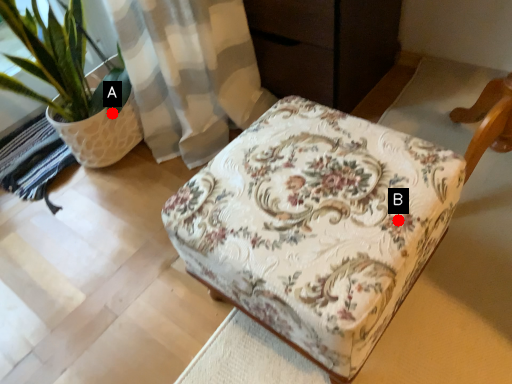
Question: Two points are circled on the image, labeled by A and B beside each circle. Which point is closer to the camera?

Choices:
 (A) A is closer
 (B) B is closer

Answer: (B)